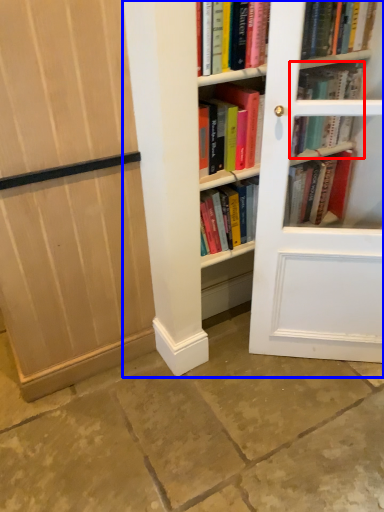
Question: Which point is further to the camera, book (highlighted by a red box) or bookcase (highlighted by a blue box)?

Choices:
 (A) book
 (B) bookcase

Answer: (A)